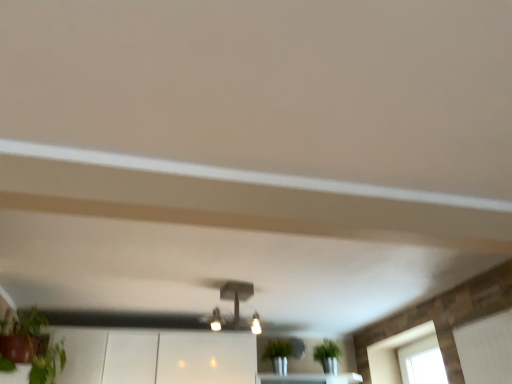
Question: Is transparent glass window at lower right bigger or smaller than matte black light fixture at center?

Choices:
 (A) small
 (B) big

Answer: (B)

Question: Is transparent glass window at lower right in front of or behind matte black light fixture at center in the image?

Choices:
 (A) front
 (B) behind

Answer: (B)

Question: Is point (386, 379) positioned closer to the camera than point (229, 286)?

Choices:
 (A) closer
 (B) farther

Answer: (B)

Question: In the image, is matte black light fixture at center positioned in front of or behind transparent glass window at lower right?

Choices:
 (A) front
 (B) behind

Answer: (A)

Question: From their relative heights in the image, would you say matte black light fixture at center is taller or shorter than transparent glass window at lower right?

Choices:
 (A) short
 (B) tall

Answer: (A)

Question: Would you say matte black light fixture at center is to the left or to the right of transparent glass window at lower right in the picture?

Choices:
 (A) right
 (B) left

Answer: (B)

Question: From the image's perspective, is matte black light fixture at center located above or below transparent glass window at lower right?

Choices:
 (A) below
 (B) above

Answer: (B)